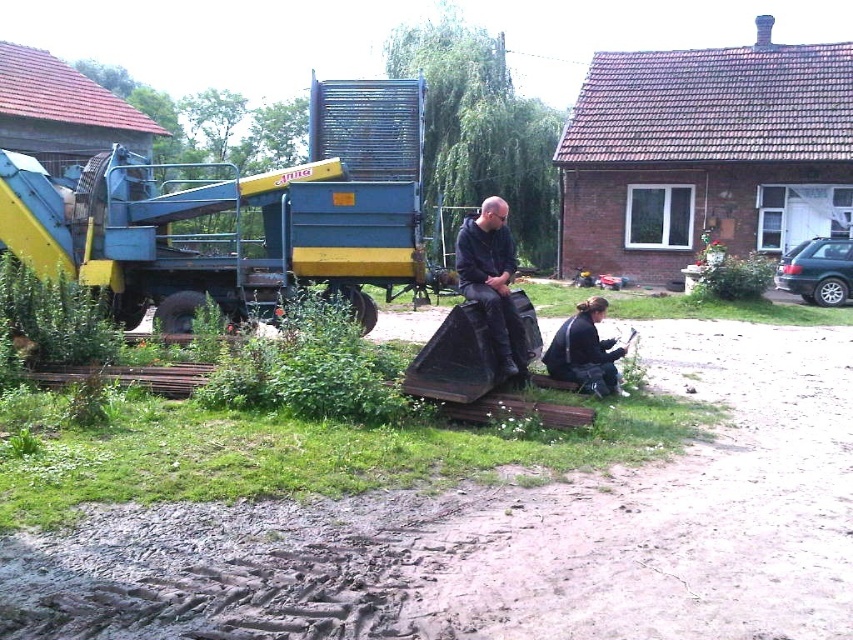
Is dark blue leather jacket at center below black fabric jacket at lower center?

No, dark blue leather jacket at center is not below black fabric jacket at lower center.

Who is more forward, (497, 232) or (618, 355)?

Point (497, 232) is more forward.

Locate an element on the screen. The image size is (853, 640). dark blue leather jacket at center is located at coordinates (492, 280).